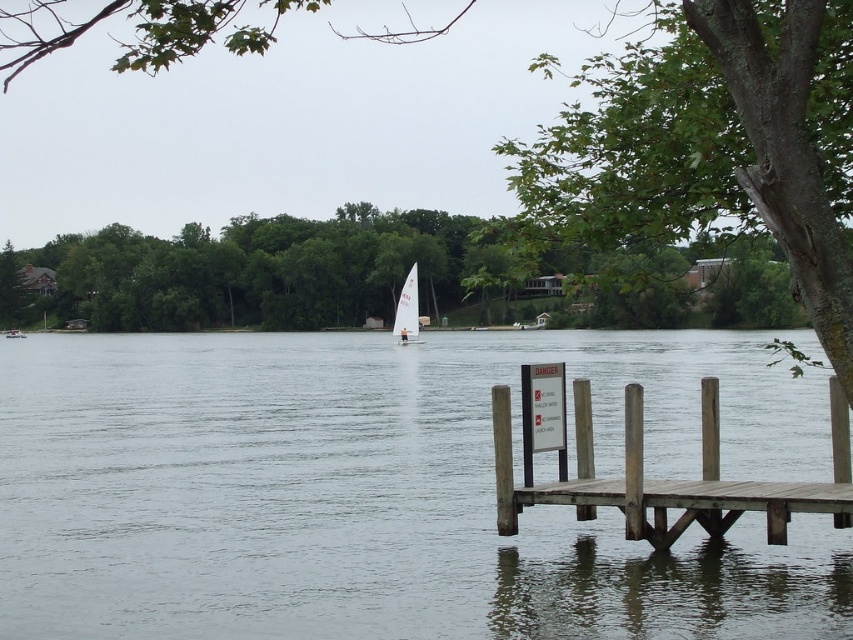
Can you confirm if green leafy tree at upper center is positioned below brown wooden dock at lower right?

No, green leafy tree at upper center is not below brown wooden dock at lower right.

Based on the photo, between green leafy tree at upper center and brown wooden dock at lower right, which one has less height?

With less height is brown wooden dock at lower right.

Between point (316, 320) and point (624, 496), which one is positioned behind?

The point (316, 320) is more distant.

Identify the location of green leafy tree at upper center. Image resolution: width=853 pixels, height=640 pixels. (379, 276).

Which is below, green leafy tree at upper right or white sailboat at center?

white sailboat at center is below.

Which is behind, point (705, 28) or point (410, 323)?

Point (410, 323)

Is point (775, 1) farther from viewer compared to point (401, 291)?

No, (775, 1) is in front of (401, 291).

The height and width of the screenshot is (640, 853). Find the location of `green leafy tree at upper right`. green leafy tree at upper right is located at coordinates (715, 144).

Can you confirm if clear water at center is wider than white sailboat at center?

Yes, clear water at center is wider than white sailboat at center.

Based on the photo, is clear water at center further to the viewer compared to white sailboat at center?

No.

Who is more forward, (796, 394) or (418, 330)?

Point (796, 394)

Where is `clear water at center`? clear water at center is located at coordinates (386, 490).